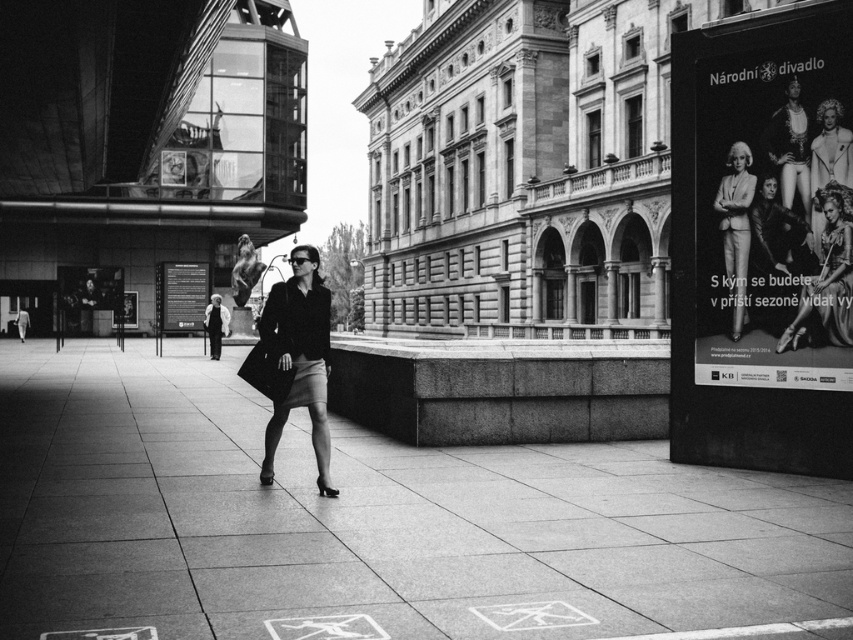
Question: Is matte black coat at center positioned at the back of matte black dress at center?

Choices:
 (A) yes
 (B) no

Answer: (B)

Question: Does matte black dress at center appear on the left side of smooth cream dress at upper right?

Choices:
 (A) yes
 (B) no

Answer: (A)

Question: Which point is farther to the camera?

Choices:
 (A) (76, 342)
 (B) (785, 336)
 (C) (712, 308)

Answer: (A)

Question: Does matte black dress at center have a lesser width compared to matte black suit at center?

Choices:
 (A) yes
 (B) no

Answer: (B)

Question: Considering the real-world distances, which object is farthest from the matte black suit at center?

Choices:
 (A) matte black dress at center
 (B) smooth cream dress at upper right

Answer: (A)

Question: Which point appears farthest from the camera in this image?

Choices:
 (A) (834, 99)
 (B) (828, 385)
 (C) (846, 209)

Answer: (A)